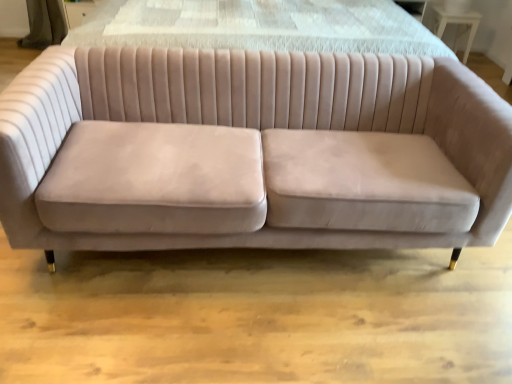
Question: From the image's perspective, is velvet beige couch at center located above or below white glossy table at upper right?

Choices:
 (A) below
 (B) above

Answer: (A)

Question: Is point (99, 97) positioned closer to the camera than point (458, 28)?

Choices:
 (A) farther
 (B) closer

Answer: (B)

Question: Considering their positions, is velvet beige couch at center located in front of or behind white glossy table at upper right?

Choices:
 (A) behind
 (B) front

Answer: (B)

Question: In terms of size, does white glossy table at upper right appear bigger or smaller than velvet beige couch at center?

Choices:
 (A) big
 (B) small

Answer: (B)

Question: In terms of height, does white glossy table at upper right look taller or shorter compared to velvet beige couch at center?

Choices:
 (A) short
 (B) tall

Answer: (A)

Question: Is white glossy table at upper right to the left or to the right of velvet beige couch at center in the image?

Choices:
 (A) left
 (B) right

Answer: (B)

Question: Would you say white glossy table at upper right is inside or outside velvet beige couch at center?

Choices:
 (A) outside
 (B) inside

Answer: (A)